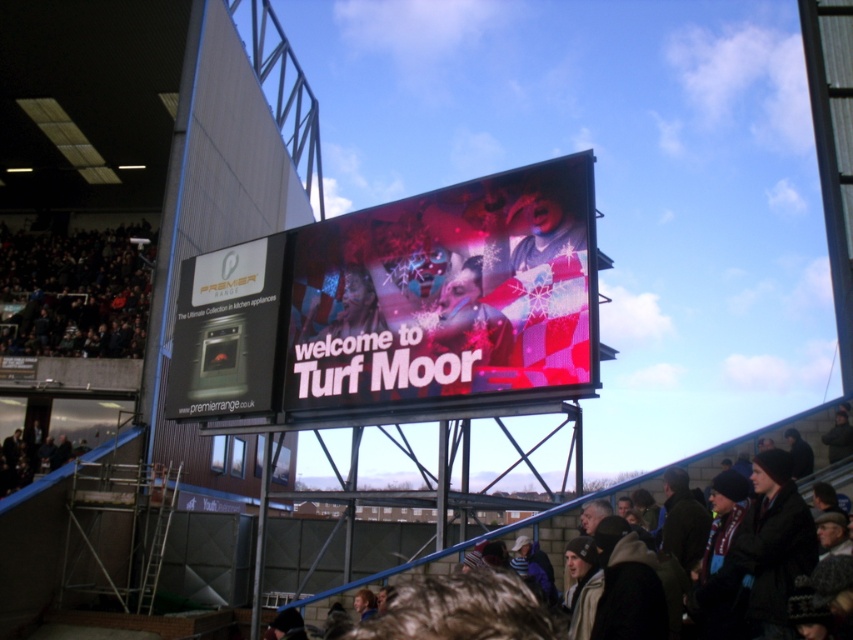
You are standing at the entrance of Turf Moor stadium and notice a dark brown fabric at upper left. If you want to take a photo of it from where you are standing, will you be able to capture it in your frame without moving closer? Please explain your reasoning based on the distance provided.

The dark brown fabric at upper left is 69.21 meters away from the viewer. Since this distance is quite far, it may be challenging to capture the fabric clearly in a photo without moving closer, as most standard cameras have difficulty focusing on objects at such a distance unless using a telephoto lens.